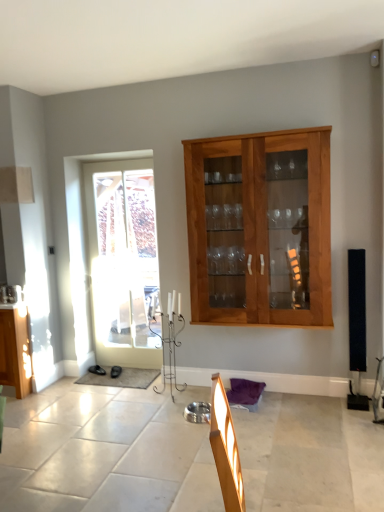
The image size is (384, 512). What are the coordinates of `white glass door at left` in the screenshot? It's located at (123, 259).

You are a GUI agent. You are given a task and a screenshot of the screen. Output one action in this format:
    pyautogui.click(x=<x>, y=<y>)
    Task: Click on the black matte speaker at right
    This screenshot has height=512, width=384.
    Given the screenshot: What is the action you would take?
    pyautogui.click(x=357, y=310)

Consider the image. Choose the correct answer: Is wooden cabinet at center inside black matte speaker at right or outside it?

wooden cabinet at center is not inside black matte speaker at right, it's outside.

From the image's perspective, which is above, wooden cabinet at center or black matte speaker at right?

wooden cabinet at center.

Can you confirm if wooden cabinet at center is smaller than black matte speaker at right?

Actually, wooden cabinet at center might be larger than black matte speaker at right.

Who is more distant, wooden cabinet at center or black matte speaker at right?

Positioned behind is black matte speaker at right.

Considering the relative sizes of black matte speaker at right and wooden cabinet at center in the image provided, is black matte speaker at right taller than wooden cabinet at center?

Incorrect, the height of black matte speaker at right is not larger of that of wooden cabinet at center.

From a real-world perspective, who is located higher, black matte speaker at right or wooden cabinet at center?

From a 3D spatial view, wooden cabinet at center is above.

Can you confirm if black matte speaker at right is bigger than wooden cabinet at center?

Actually, black matte speaker at right might be smaller than wooden cabinet at center.

From the image's perspective, which is below, black matte speaker at right or wooden cabinet at center?

black matte speaker at right is shown below in the image.

Does point (349, 367) appear closer or farther from the camera than point (133, 310)?

Point (349, 367) appears to be closer to the viewer than point (133, 310).

Can you confirm if black matte speaker at right is thinner than white glass door at left?

No.

Is the depth of black matte speaker at right greater than that of white glass door at left?

No, the depth of black matte speaker at right is less than that of white glass door at left.

Considering the sizes of objects black matte speaker at right and white glass door at left in the image provided, who is taller, black matte speaker at right or white glass door at left?

With more height is white glass door at left.

From a real-world perspective, is wooden cabinet at center on top of white glass door at left?

Indeed, from a real-world perspective, wooden cabinet at center stands above white glass door at left.

Between wooden cabinet at center and white glass door at left, which one has less height?

wooden cabinet at center is shorter.

The height and width of the screenshot is (512, 384). I want to click on door behind the wooden cabinet at center, so click(x=123, y=259).

Which object is positioned more to the right, wooden cabinet at center or white glass door at left?

wooden cabinet at center is more to the right.

Considering their positions, is white glass door at left located in front of or behind black matte speaker at right?

white glass door at left is positioned farther from the viewer than black matte speaker at right.

Is white glass door at left turned away from black matte speaker at right?

No, black matte speaker at right is not at the back of white glass door at left.

Considering the relative sizes of white glass door at left and black matte speaker at right in the image provided, is white glass door at left smaller than black matte speaker at right?

Actually, white glass door at left might be larger than black matte speaker at right.

This screenshot has height=512, width=384. What are the coordinates of `door lying on the left of black matte speaker at right` in the screenshot? It's located at (123, 259).

Is white glass door at left not close to wooden cabinet at center?

Yes, white glass door at left and wooden cabinet at center are located far from each other.

From the image's perspective, between white glass door at left and wooden cabinet at center, which one is located above?

wooden cabinet at center is shown above in the image.

Considering the sizes of objects white glass door at left and wooden cabinet at center in the image provided, who is taller, white glass door at left or wooden cabinet at center?

With more height is white glass door at left.

Is white glass door at left positioned behind wooden cabinet at center?

Yes, it is.

In order to click on loudspeaker located on the right of wooden cabinet at center in this screenshot , I will do (x=357, y=310).

You are a GUI agent. You are given a task and a screenshot of the screen. Output one action in this format:
    pyautogui.click(x=<x>, y=<y>)
    Task: Click on the loudspeaker behind the wooden cabinet at center
    This screenshot has width=384, height=512.
    Given the screenshot: What is the action you would take?
    pyautogui.click(x=357, y=310)

Considering their positions, is black matte speaker at right positioned closer to wooden cabinet at center than white glass door at left?

black matte speaker at right is closer to wooden cabinet at center.

Based on their spatial positions, is black matte speaker at right or wooden cabinet at center further from white glass door at left?

black matte speaker at right.

When comparing their distances from white glass door at left, does wooden cabinet at center or black matte speaker at right seem further?

black matte speaker at right lies further to white glass door at left than the other object.

When comparing their distances from black matte speaker at right, does wooden cabinet at center or white glass door at left seem further?

Based on the image, white glass door at left appears to be further to black matte speaker at right.

Based on their spatial positions, is white glass door at left or wooden cabinet at center closer to black matte speaker at right?

wooden cabinet at center is positioned closer to the anchor black matte speaker at right.

From the image, which object appears to be farther from wooden cabinet at center, white glass door at left or black matte speaker at right?

white glass door at left is further to wooden cabinet at center.

I want to click on cabinet located between white glass door at left and black matte speaker at right in the left-right direction, so click(260, 228).